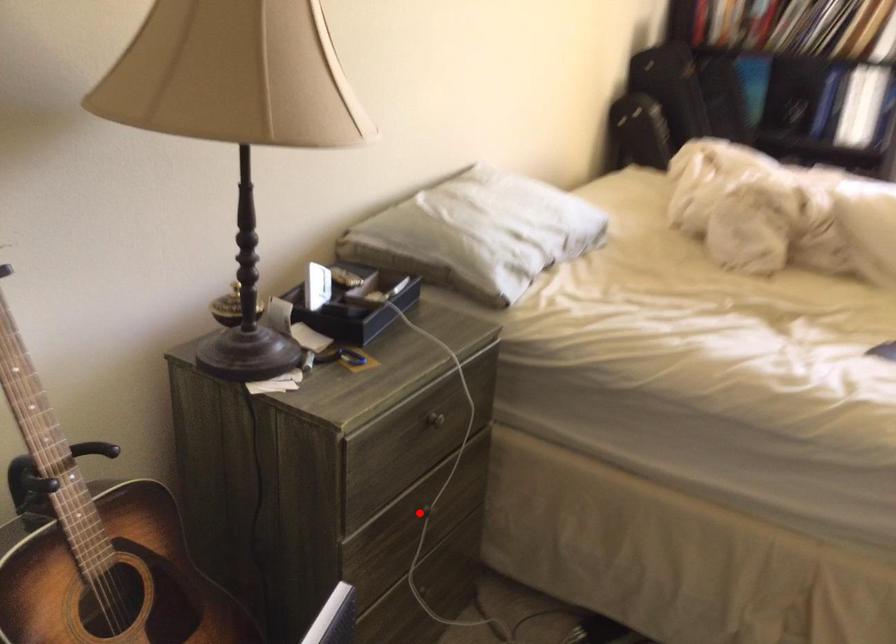
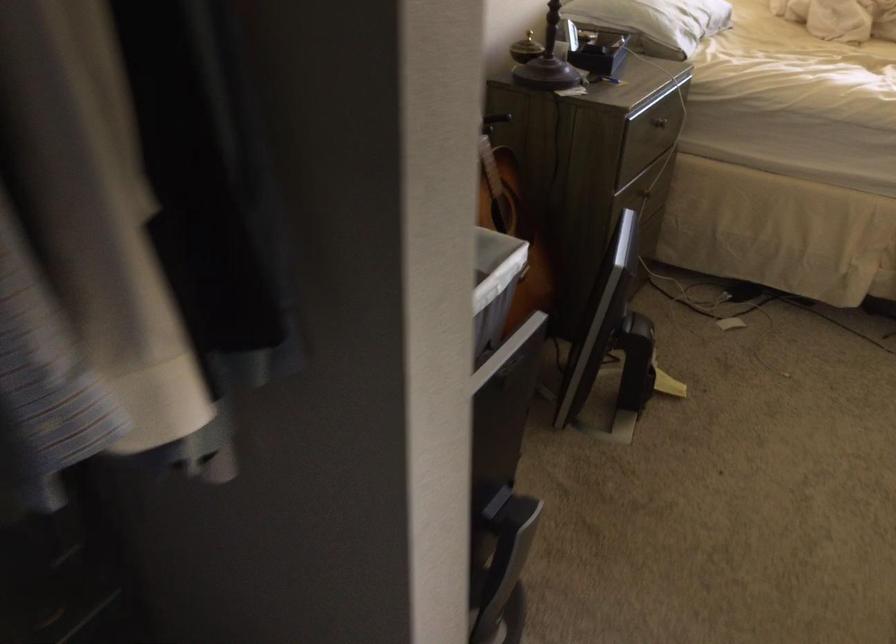
Question: I am providing you with two images of the same scene from different viewpoints. A red point is shown in image1. For the corresponding object point in image2, is it positioned nearer or farther from the camera?

Choices:
 (A) Nearer
 (B) Farther

Answer: (B)